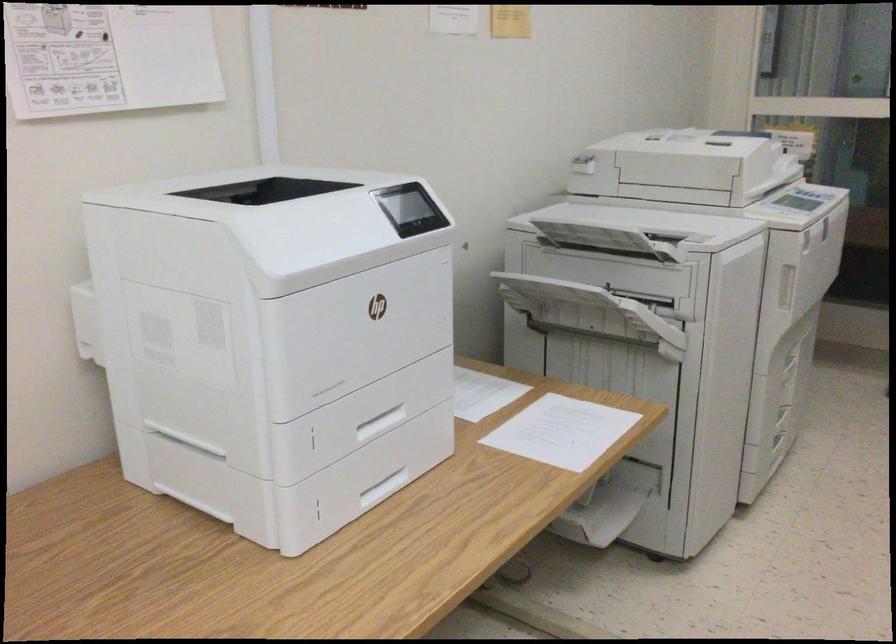
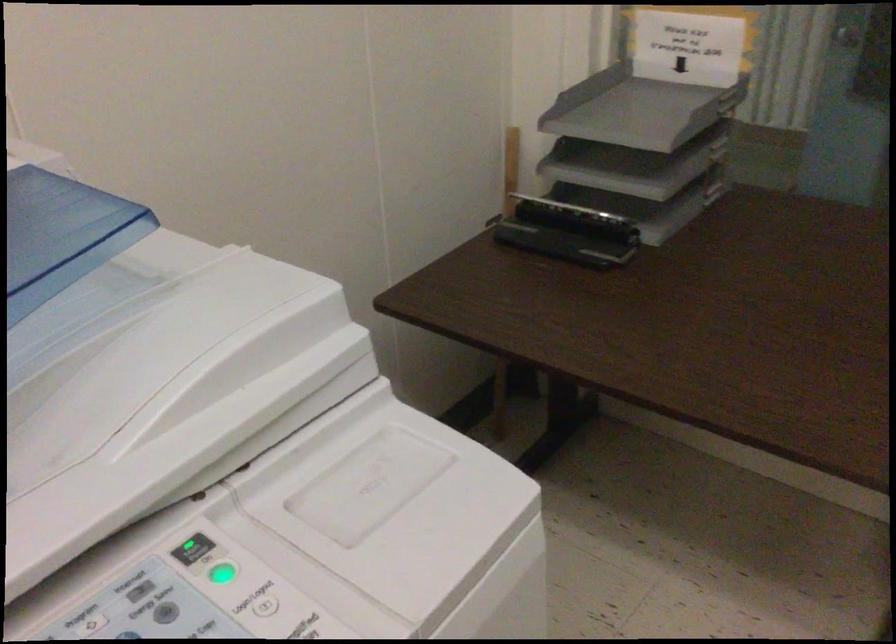
What movement of the cameraman would produce the second image?

The cameraman walked toward right, forward.